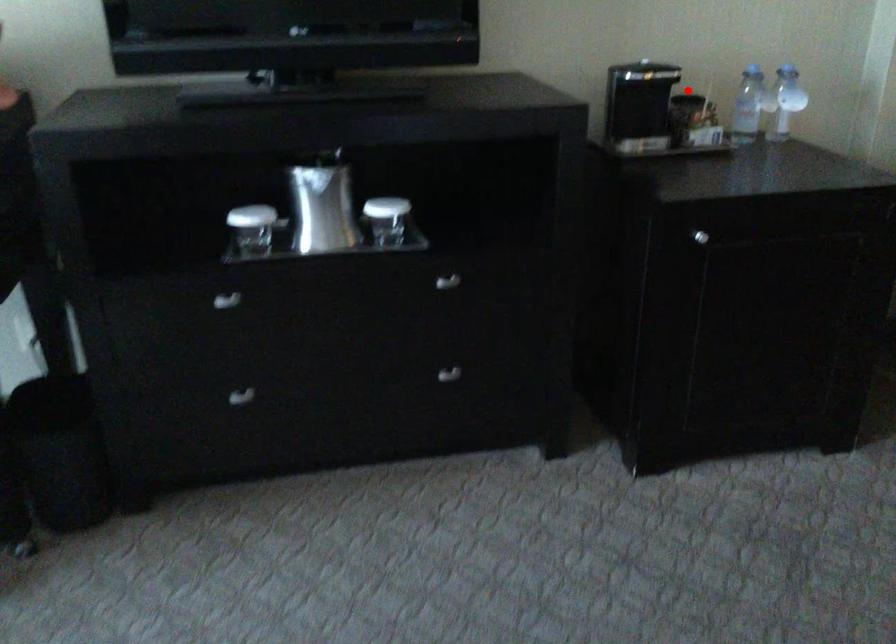
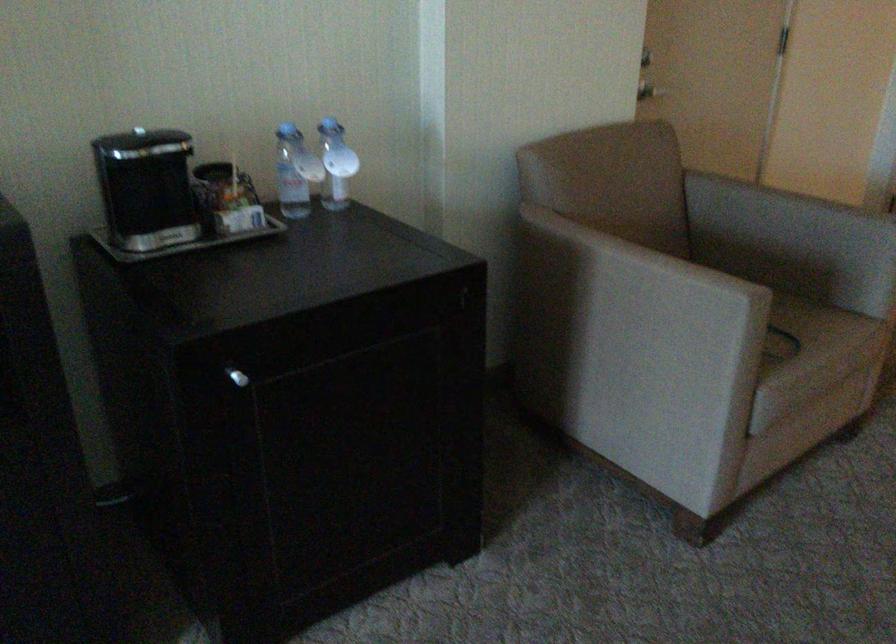
Question: A red point is marked in image1. In image2, is the corresponding 3D point closer to the camera or farther? Reply with the corresponding letter.

Choices:
 (A) The corresponding 3D point is closer.
 (B) The corresponding 3D point is farther.

Answer: (A)